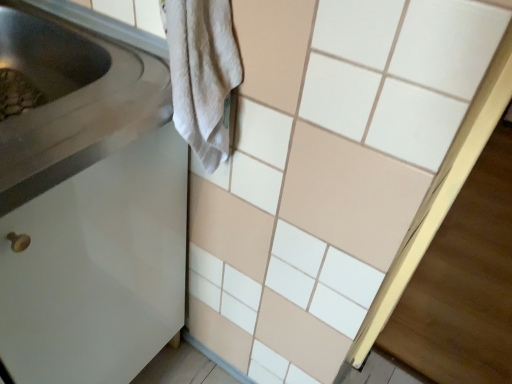
What is the approximate height of satin white cabinet at left?

satin white cabinet at left is 31.28 inches in height.

Describe the element at coordinates (88, 207) in the screenshot. I see `satin white cabinet at left` at that location.

Find the location of a particular element. satin white cabinet at left is located at coordinates (88, 207).

In order to face satin white cabinet at left, should I rotate leftwards or rightwards?

It's best to rotate left around 26.363 degrees.

I want to click on satin white cabinet at left, so click(88, 207).